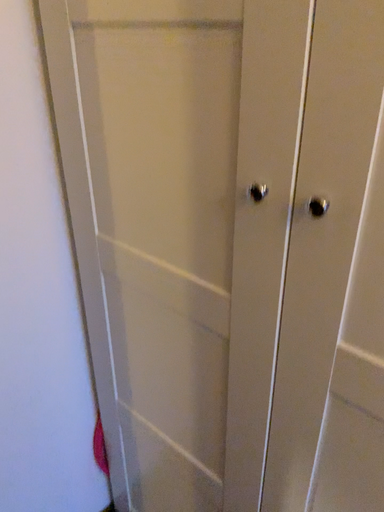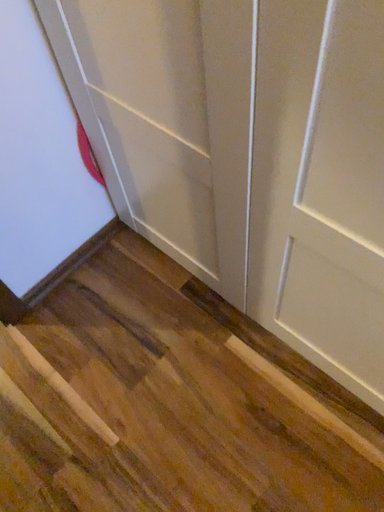
Question: Which way did the camera rotate in the video?

Choices:
 (A) rotated downward
 (B) rotated upward

Answer: (A)